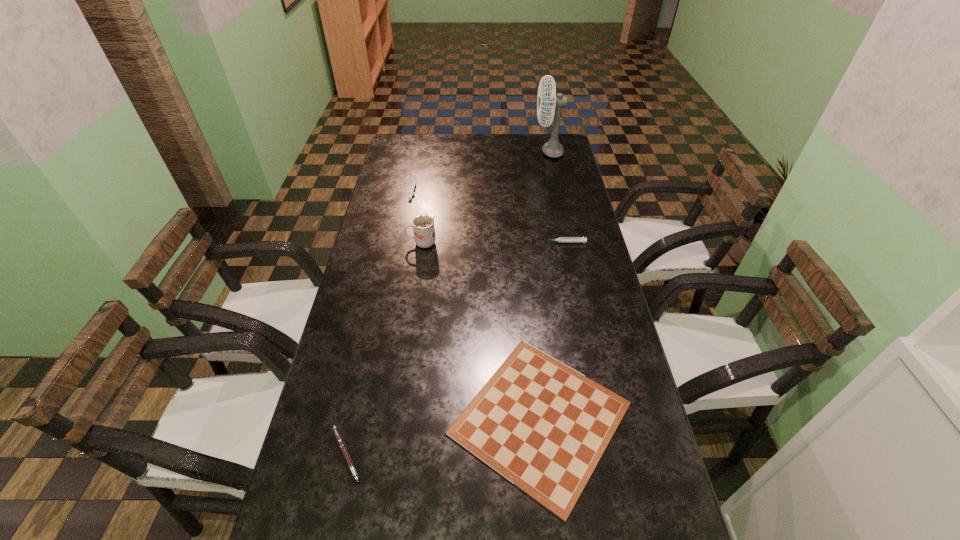
Where is `cup present at the left edge`? This screenshot has width=960, height=540. cup present at the left edge is located at coordinates (423, 225).

Image resolution: width=960 pixels, height=540 pixels. I want to click on syringe present at the left edge, so click(411, 192).

Where is `pen at the left edge`? This screenshot has width=960, height=540. pen at the left edge is located at coordinates (337, 434).

Locate an element on the screen. fan positioned at the right edge is located at coordinates (552, 148).

At what (x,y) coordinates should I click in order to perform the action: click on syringe present at the right edge. Please return your answer as a coordinate pair (x, y). The height and width of the screenshot is (540, 960). Looking at the image, I should click on (561, 239).

You are a GUI agent. You are given a task and a screenshot of the screen. Output one action in this format:
    pyautogui.click(x=<x>, y=<y>)
    Task: Click on the checkerboard at the right edge
    Image resolution: width=960 pixels, height=540 pixels.
    Given the screenshot: What is the action you would take?
    pyautogui.click(x=543, y=426)

Find the location of `object situated at the far right corner`. object situated at the far right corner is located at coordinates (552, 148).

At what (x,y) coordinates should I click in order to perform the action: click on vacant region at the far edge. Please return your answer as a coordinate pair (x, y). The image size is (960, 540). Looking at the image, I should click on (522, 144).

In the image, there is a desktop. Identify the location of free space at the left edge. Image resolution: width=960 pixels, height=540 pixels. (324, 474).

Where is `vacant space at the right edge`? The height and width of the screenshot is (540, 960). vacant space at the right edge is located at coordinates (591, 345).